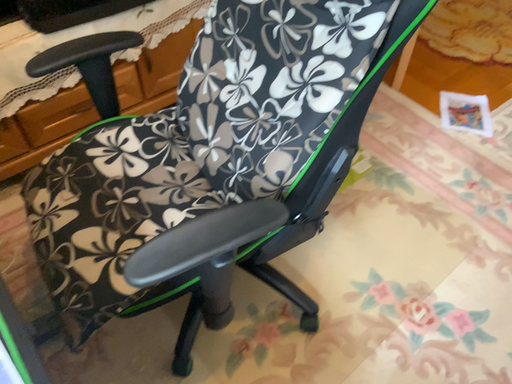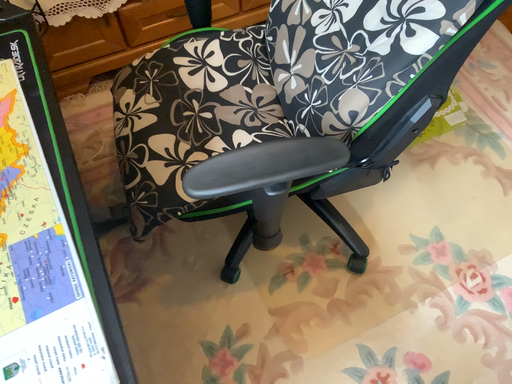
Question: How did the camera likely rotate when shooting the video?

Choices:
 (A) rotated upward
 (B) rotated downward

Answer: (B)